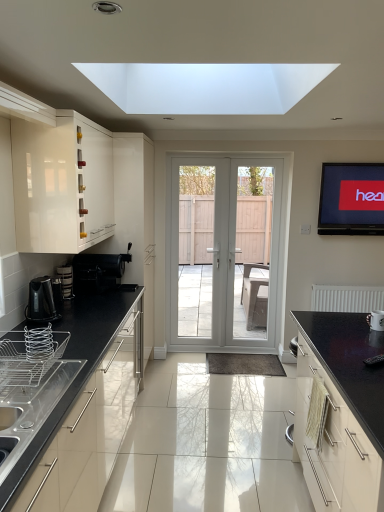
Question: Based on their positions, is silver metallic wire basket at lower left, which is the 2th appliance in right-to-left order, located to the left or right of glossy black countertop at right, placed as the second cabinetry when sorted from left to right?

Choices:
 (A) right
 (B) left

Answer: (B)

Question: Do you think silver metallic wire basket at lower left, which ranks as the 3th appliance in back-to-front order, is within glossy black countertop at right, acting as the 1th cabinetry starting from the right, or outside of it?

Choices:
 (A) outside
 (B) inside

Answer: (A)

Question: Based on their relative distances, which object is nearer to the glossy black countertop at right, acting as the 1th cabinetry starting from the right?

Choices:
 (A) metallic silver kettle at lower left, the 3th appliance in the right-to-left sequence
 (B) white glossy screen door at center, which ranks as the first screen door in left-to-right order
 (C) white matte radiator at right
 (D) black plastic coffee machine at lower left
 (E) silver metallic wire basket at lower left, placed as the second appliance when sorted from left to right

Answer: (E)

Question: Which is farther from the white glossy screen door at center, the 2th screen door from the right?

Choices:
 (A) white glossy door at center, the second screen door when ordered from left to right
 (B) white glossy mug at lower right, which is the second appliance from back to front
 (C) metallic silver kettle at lower left, placed as the 1th appliance when sorted from back to front
 (D) glossy white cabinet at left, which is counted as the first cabinetry, starting from the left
 (E) silver metallic wire basket at lower left, which ranks as the 3th appliance in back-to-front order

Answer: (E)